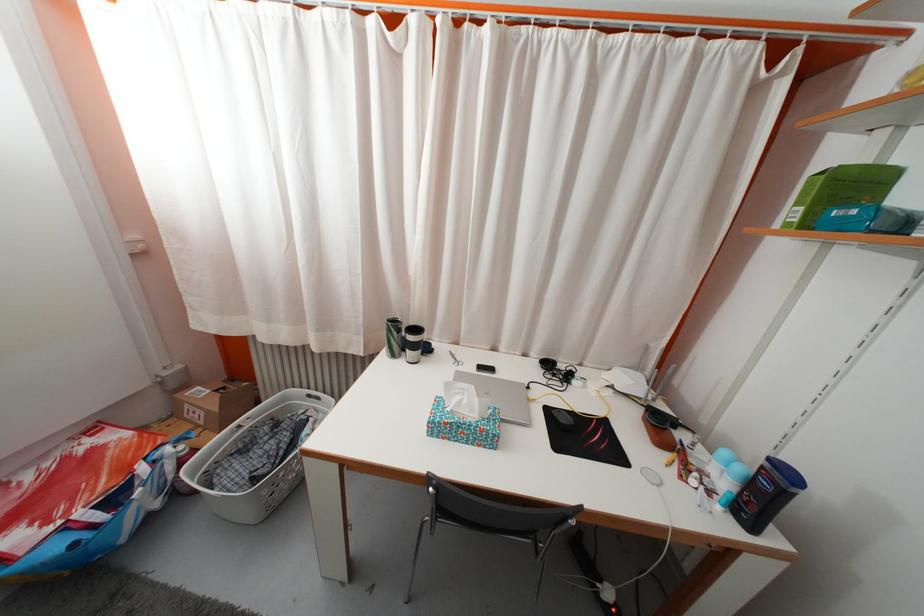
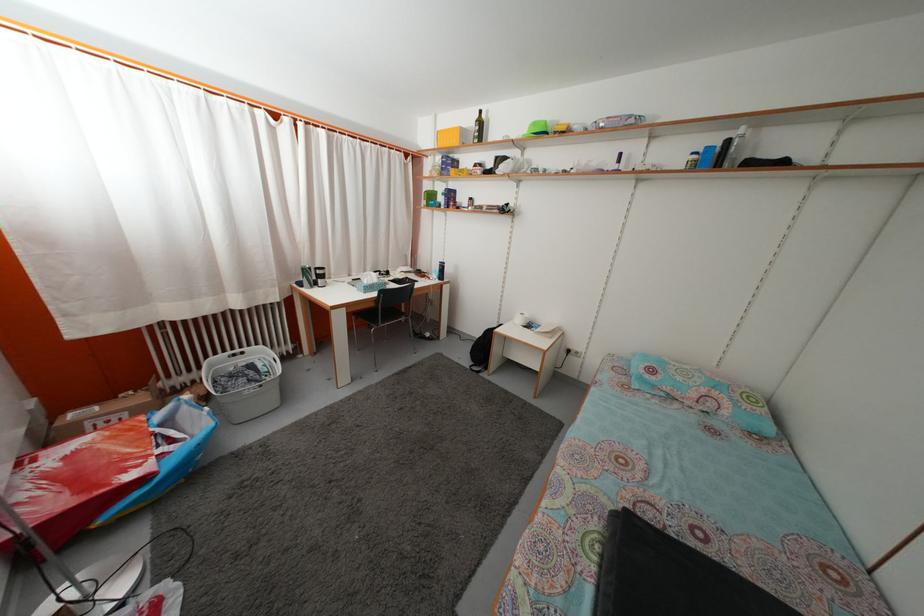
Where in the second image is the point corresponding to the point at 500,355 from the first image?

(355, 283)